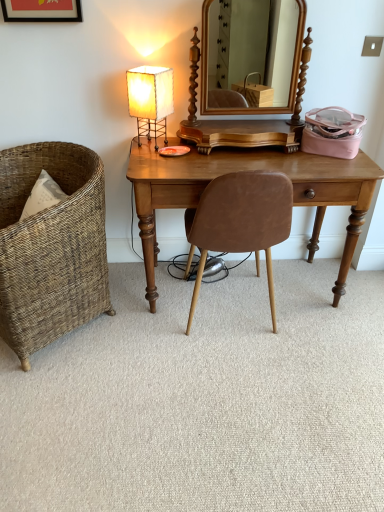
Locate an element on the screen. vacant area that is in front of white paper lampshade at upper left is located at coordinates (160, 154).